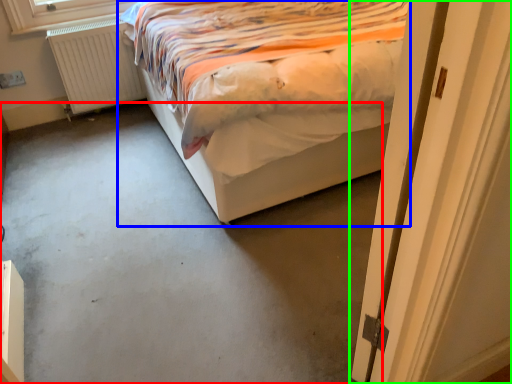
Question: Which object is positioned closest to concrete (highlighted by a red box)? Select from bed (highlighted by a blue box) and door (highlighted by a green box).

Choices:
 (A) bed
 (B) door

Answer: (A)